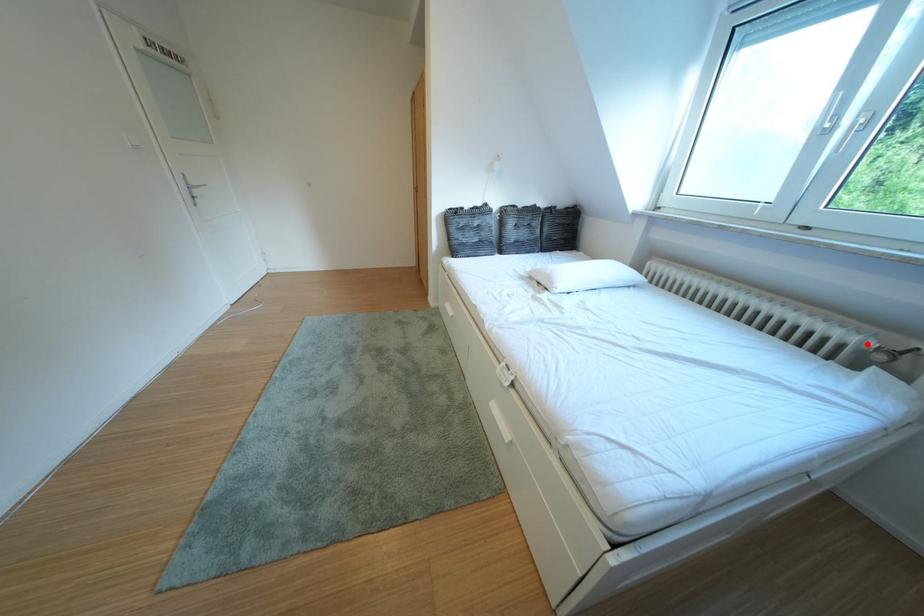
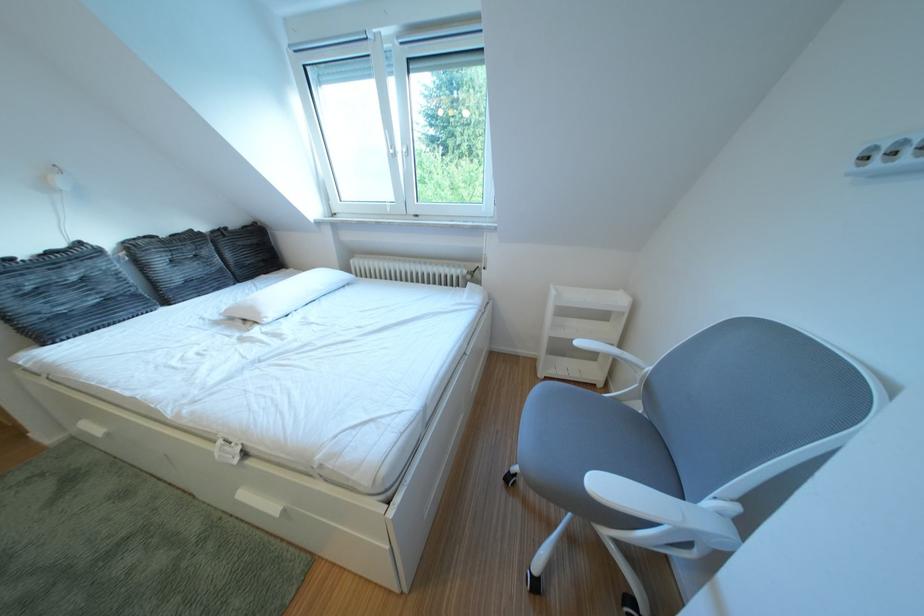
Question: I am providing you with two images of the same scene from different viewpoints. Image1 has a red point marked. In image2, the corresponding 3D location appears at what relative position? Reply with the corresponding letter.

Choices:
 (A) Closer
 (B) Farther

Answer: (A)